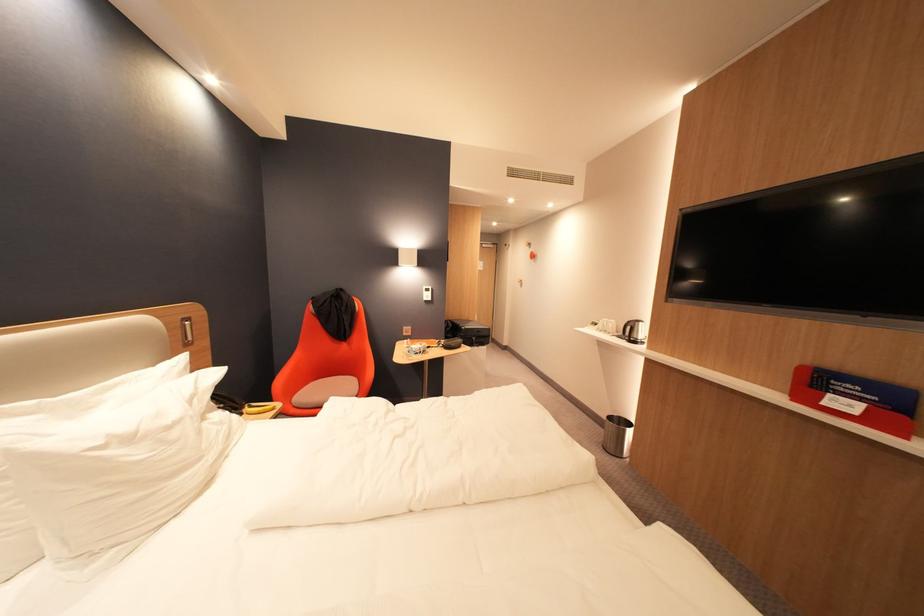
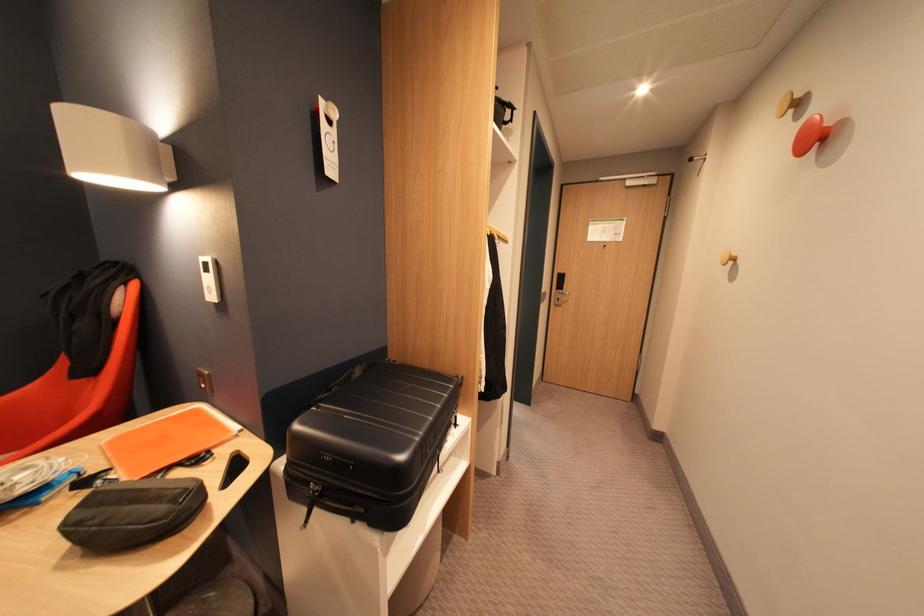
In the second image, find the point that corresponds to the point at 439,290 in the first image.

(216, 265)